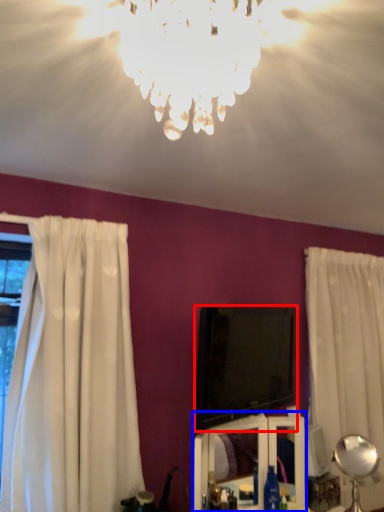
Question: Which object appears farthest to the camera in this image, television (highlighted by a red box) or vanity (highlighted by a blue box)?

Choices:
 (A) television
 (B) vanity

Answer: (A)